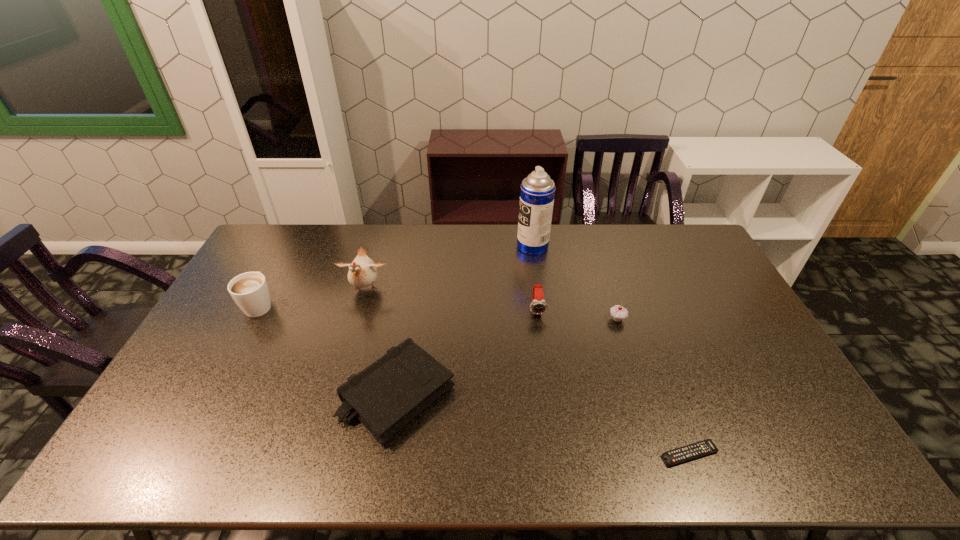
In order to click on vacant area situated 0.220m on the label side of the farthest object in this screenshot , I will do `click(459, 246)`.

This screenshot has width=960, height=540. Find the location of `vacant area situated 0.050m on the label side of the farthest object`. vacant area situated 0.050m on the label side of the farthest object is located at coordinates (504, 246).

The image size is (960, 540). I want to click on vacant region located at the beak of the bird, so click(x=354, y=326).

You are a GUI agent. You are given a task and a screenshot of the screen. Output one action in this format:
    pyautogui.click(x=<x>, y=<y>)
    Task: Click on the vacant space located with the handle on the side of the cappuccino
    The width and height of the screenshot is (960, 540).
    Given the screenshot: What is the action you would take?
    pyautogui.click(x=289, y=251)

Where is `vacant space situated 0.190m with the handle on the side of the cappuccino`? This screenshot has height=540, width=960. vacant space situated 0.190m with the handle on the side of the cappuccino is located at coordinates (286, 255).

The height and width of the screenshot is (540, 960). Identify the location of free space located 0.090m with the handle on the side of the cappuccino. (276, 273).

The width and height of the screenshot is (960, 540). I want to click on vacant space located 0.350m on the face of the watch, so click(552, 417).

The image size is (960, 540). Identify the location of vacant area located on the front of the cupcake. (650, 420).

What are the coordinates of `blank space located 0.170m on the left of the sixth tallest object` in the screenshot? It's located at (278, 394).

I want to click on vacant space located 0.150m on the right of the remote control, so click(781, 454).